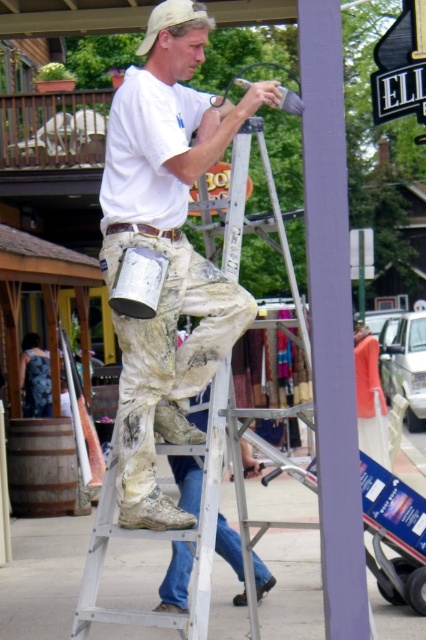
The user is trying to determine the exact position of the silver metallic ladder at center in the image. Using the coordinate system where the bottom left corner is the origin, can you provide its coordinates?

The silver metallic ladder at center is located at the coordinates point (160, 538).

In the scene shown: You are a painter who needs to place a new wooden barrel next to the silver metallic ladder at center. Given their sizes, can the wooden barrel at lower left fit next to the ladder without moving it?

The silver metallic ladder at center is narrower than the wooden barrel at lower left, so there should be enough space to place the wooden barrel at lower left next to the ladder without moving it.

You are a delivery person trying to unload a package from your truck parked near the wooden barrel at lower left. To avoid hitting the silver metallic ladder at center, how should you position your truck?

The silver metallic ladder at center is taller than the wooden barrel at lower left. To avoid hitting the ladder, position your truck so that it is parked behind the wooden barrel at lower left, as the ladder is taller and extends higher than the barrel, providing a clear path around it.